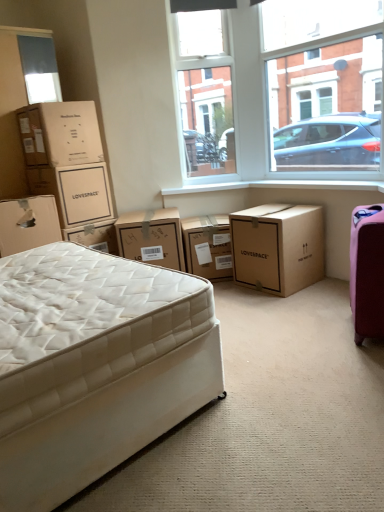
Question: Is matte brown cardboard box at upper left, placed as the 4th box when sorted from right to left, taller or shorter than brown cardboard box at center, which appears as the 3th box when viewed from the right?

Choices:
 (A) short
 (B) tall

Answer: (A)

Question: Considering the positions of matte brown cardboard box at upper left, placed as the 4th box when sorted from right to left, and brown cardboard box at center, arranged as the 4th box when viewed from the left, in the image, is matte brown cardboard box at upper left, placed as the 4th box when sorted from right to left, wider or thinner than brown cardboard box at center, arranged as the 4th box when viewed from the left,?

Choices:
 (A) thin
 (B) wide

Answer: (A)

Question: Considering the real-world distances, which object is closest to the brown cardboard box at center, arranged as the first box when viewed from the right?

Choices:
 (A) brown cardboard box at upper left, which is the fifth box in right-to-left order
 (B) white quilted mattress at lower left
 (C) pink fabric suitcase at right
 (D) clear glass window at upper center
 (E) transparent glass window at upper center

Answer: (C)

Question: Which of these objects is positioned closest to the matte brown cardboard box at upper left, acting as the third box starting from the left?

Choices:
 (A) white cardboard box at left, which is the 1th box from left to right
 (B) white quilted mattress at lower left
 (C) brown cardboard box at center, which appears as the 3th box when viewed from the right
 (D) brown cardboard box at center, the 5th box positioned from the left
 (E) brown cardboard box at center, arranged as the first box when viewed from the right

Answer: (A)